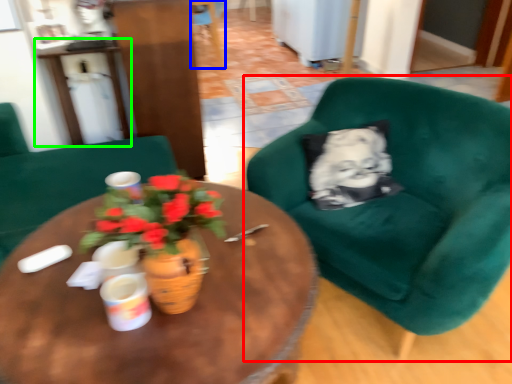
Question: Estimate the real-world distances between objects in this image. Which object is farther from chair (highlighted by a red box), chair (highlighted by a blue box) or table (highlighted by a green box)?

Choices:
 (A) chair
 (B) table

Answer: (A)